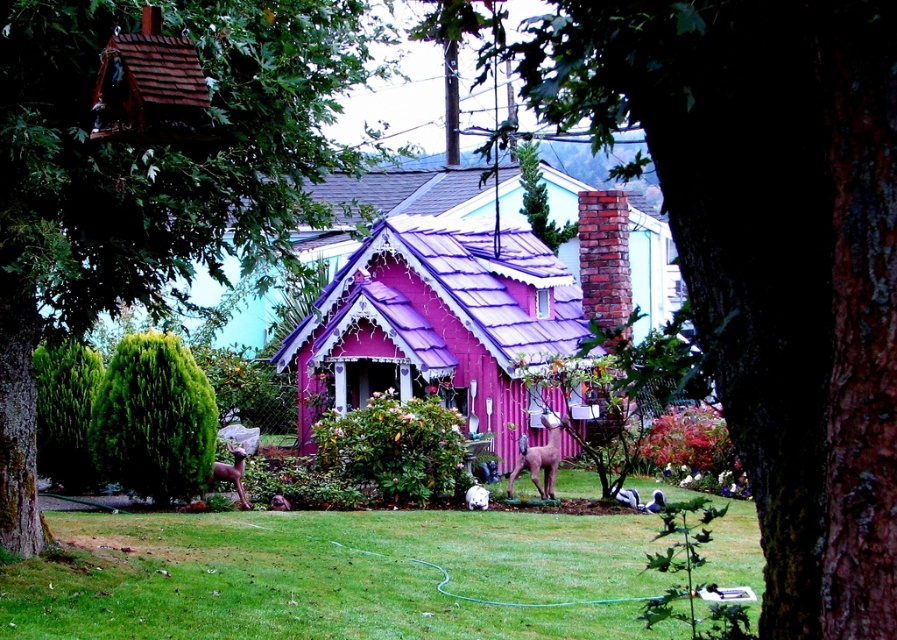
Looking at this image, you are standing in the garden looking at the purple matte tree at center and the pink corrugated metal hut at center. Which object is closer to you?

The purple matte tree at center is closer to you because it is positioned over the pink corrugated metal hut at center, indicating it is in front.

You are standing in front of the small pink house and notice the purple matte tree at center and the brown matte statue at lower center. Which object is positioned higher relative to the other?

The purple matte tree at center is positioned above the brown matte statue at lower center.

You are standing in front of the pink house and want to take a photo. You notice two points marked in the scene. The first point is at coordinate point [774,488] and the second is at point [231,470]. Which point will appear larger in your camera view?

Point [774,488] is closer to the camera than point [231,470], so it will appear larger in the camera view.